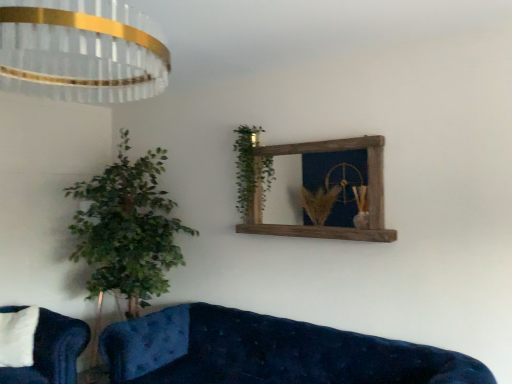
Describe the element at coordinates (326, 226) in the screenshot. I see `rustic wood mirror at upper center` at that location.

Identify the location of green leafy plant at upper center. (246, 166).

What are the coordinates of `crystal glass chandelier at upper left` in the screenshot? It's located at (81, 51).

How much space does velvet blue studio couch at lower left, the 1th studio couch positioned from the left, occupy horizontally?

9.05 inches.

I want to click on velvet blue couch at lower center, the second studio couch from the back, so click(x=269, y=352).

Between green leafy plant at left and velvet blue couch at lower center, the 2th studio couch viewed from the left, which one appears on the right side from the viewer's perspective?

velvet blue couch at lower center, the 2th studio couch viewed from the left.

From the image's perspective, is green leafy plant at left over velvet blue couch at lower center, marked as the 1th studio couch in a front-to-back arrangement?

Yes.

How much distance is there between green leafy plant at left and velvet blue couch at lower center, the second studio couch from the back?

31.45 inches.

Is green leafy plant at left aimed at velvet blue couch at lower center, marked as the first studio couch in a right-to-left arrangement?

No.

Based on the photo, would you say rustic wood mirror at upper center is a long distance from velvet blue couch at lower center, the second studio couch from the back?

rustic wood mirror at upper center is near velvet blue couch at lower center, the second studio couch from the back, not far away.

In the scene shown: Does rustic wood mirror at upper center have a lesser height compared to velvet blue couch at lower center, the second studio couch from the back?

Correct, rustic wood mirror at upper center is not as tall as velvet blue couch at lower center, the second studio couch from the back.

Which object is closer to the camera, rustic wood mirror at upper center or velvet blue couch at lower center, marked as the 1th studio couch in a front-to-back arrangement?

Positioned in front is velvet blue couch at lower center, marked as the 1th studio couch in a front-to-back arrangement.

Is point (377, 234) behind point (209, 344)?

That is False.

Considering the sizes of objects green leafy plant at left and rustic wood mirror at upper center in the image provided, who is wider, green leafy plant at left or rustic wood mirror at upper center?

With larger width is green leafy plant at left.

Is green leafy plant at left in contact with rustic wood mirror at upper center?

green leafy plant at left and rustic wood mirror at upper center are not in contact.

Which is in front, point (110, 166) or point (382, 214)?

The point (382, 214) is in front.

From the image's perspective, does green leafy plant at left appear higher than rustic wood mirror at upper center?

No, from the image's perspective, green leafy plant at left is not on top of rustic wood mirror at upper center.

Does velvet blue studio couch at lower left, which is the first studio couch from back to front, have a greater height compared to velvet blue couch at lower center, marked as the first studio couch in a right-to-left arrangement?

Incorrect, the height of velvet blue studio couch at lower left, which is the first studio couch from back to front, is not larger of that of velvet blue couch at lower center, marked as the first studio couch in a right-to-left arrangement.

Considering the relative sizes of velvet blue studio couch at lower left, the 1th studio couch positioned from the left, and velvet blue couch at lower center, marked as the 1th studio couch in a front-to-back arrangement, in the image provided, is velvet blue studio couch at lower left, the 1th studio couch positioned from the left, wider than velvet blue couch at lower center, marked as the 1th studio couch in a front-to-back arrangement,?

Incorrect, the width of velvet blue studio couch at lower left, the 1th studio couch positioned from the left, does not surpass that of velvet blue couch at lower center, marked as the 1th studio couch in a front-to-back arrangement.

Who is smaller, velvet blue studio couch at lower left, the 2th studio couch in the right-to-left sequence, or velvet blue couch at lower center, the second studio couch from the back?

Smaller between the two is velvet blue studio couch at lower left, the 2th studio couch in the right-to-left sequence.

Consider the image. From the image's perspective, is velvet blue studio couch at lower left, the 2th studio couch positioned from the front, located above velvet blue couch at lower center, the 2th studio couch viewed from the left?

Correct, velvet blue studio couch at lower left, the 2th studio couch positioned from the front, appears higher than velvet blue couch at lower center, the 2th studio couch viewed from the left, in the image.

Is crystal glass chandelier at upper left not inside rustic wood mirror at upper center?

crystal glass chandelier at upper left is positioned outside rustic wood mirror at upper center.

From a real-world perspective, is crystal glass chandelier at upper left over rustic wood mirror at upper center?

Yes.

Looking at this image, is crystal glass chandelier at upper left positioned far away from rustic wood mirror at upper center?

Yes, crystal glass chandelier at upper left and rustic wood mirror at upper center are quite far apart.

Between green leafy plant at upper center and crystal glass chandelier at upper left, which one appears on the right side from the viewer's perspective?

green leafy plant at upper center is more to the right.

In the image, is green leafy plant at upper center positioned in front of or behind crystal glass chandelier at upper left?

Visually, green leafy plant at upper center is located behind crystal glass chandelier at upper left.

Does green leafy plant at upper center have a lesser height compared to crystal glass chandelier at upper left?

In fact, green leafy plant at upper center may be taller than crystal glass chandelier at upper left.

Which object is thinner, green leafy plant at upper center or crystal glass chandelier at upper left?

Thinner between the two is green leafy plant at upper center.

Who is more distant, rustic wood mirror at upper center or crystal glass chandelier at upper left?

rustic wood mirror at upper center is behind.

What are the coordinates of `window frame lying below the crystal glass chandelier at upper left (from the image's perspective)` in the screenshot? It's located at (326, 226).

Is rustic wood mirror at upper center at the left side of crystal glass chandelier at upper left?

No.

Is rustic wood mirror at upper center directly adjacent to crystal glass chandelier at upper left?

No, rustic wood mirror at upper center is not with crystal glass chandelier at upper left.

At what (x,y) coordinates should I click in order to perform the action: click on the 2nd studio couch in front of the green leafy plant at left, counting from the anchor's position. Please return your answer as a coordinate pair (x, y). This screenshot has width=512, height=384. Looking at the image, I should click on (269, 352).

I want to click on studio couch that is the 1st one when counting leftward from the rustic wood mirror at upper center, so (269, 352).

From the image, which object appears to be nearer to crystal glass chandelier at upper left, velvet blue couch at lower center, the 2th studio couch viewed from the left, or rustic wood mirror at upper center?

rustic wood mirror at upper center lies closer to crystal glass chandelier at upper left than the other object.

From the image, which object appears to be nearer to velvet blue couch at lower center, marked as the 1th studio couch in a front-to-back arrangement, velvet blue studio couch at lower left, the 1th studio couch positioned from the left, or green leafy plant at upper center?

Based on the image, velvet blue studio couch at lower left, the 1th studio couch positioned from the left, appears to be nearer to velvet blue couch at lower center, marked as the 1th studio couch in a front-to-back arrangement.

Looking at the image, which one is located further to rustic wood mirror at upper center, velvet blue studio couch at lower left, the 2th studio couch positioned from the front, or velvet blue couch at lower center, marked as the 1th studio couch in a front-to-back arrangement?

Based on the image, velvet blue studio couch at lower left, the 2th studio couch positioned from the front, appears to be further to rustic wood mirror at upper center.

From the image, which object appears to be farther from rustic wood mirror at upper center, crystal glass chandelier at upper left or green leafy plant at left?

The object further to rustic wood mirror at upper center is crystal glass chandelier at upper left.

Estimate the real-world distances between objects in this image. Which object is further from crystal glass chandelier at upper left, rustic wood mirror at upper center or green leafy plant at left?

rustic wood mirror at upper center is positioned further to the anchor crystal glass chandelier at upper left.

Based on their spatial positions, is rustic wood mirror at upper center or green leafy plant at upper center closer to velvet blue couch at lower center, marked as the first studio couch in a right-to-left arrangement?

rustic wood mirror at upper center lies closer to velvet blue couch at lower center, marked as the first studio couch in a right-to-left arrangement, than the other object.

Considering their positions, is velvet blue studio couch at lower left, the 1th studio couch positioned from the left, positioned closer to green leafy plant at left than crystal glass chandelier at upper left?

velvet blue studio couch at lower left, the 1th studio couch positioned from the left, lies closer to green leafy plant at left than the other object.

Which object lies nearer to the anchor point rustic wood mirror at upper center, green leafy plant at upper center or velvet blue couch at lower center, the 2th studio couch viewed from the left?

The object closer to rustic wood mirror at upper center is green leafy plant at upper center.

The image size is (512, 384). Identify the location of houseplant between crystal glass chandelier at upper left and green leafy plant at upper center in the front-back direction. (127, 229).

You are a GUI agent. You are given a task and a screenshot of the screen. Output one action in this format:
    pyautogui.click(x=<x>, y=<y>)
    Task: Click on the window frame positioned between crystal glass chandelier at upper left and green leafy plant at left from near to far
    The width and height of the screenshot is (512, 384).
    Given the screenshot: What is the action you would take?
    pyautogui.click(x=326, y=226)

You are a GUI agent. You are given a task and a screenshot of the screen. Output one action in this format:
    pyautogui.click(x=<x>, y=<y>)
    Task: Click on the window frame between crystal glass chandelier at upper left and velvet blue couch at lower center, the 2th studio couch viewed from the left, vertically
    
    Given the screenshot: What is the action you would take?
    pyautogui.click(x=326, y=226)

You are a GUI agent. You are given a task and a screenshot of the screen. Output one action in this format:
    pyautogui.click(x=<x>, y=<y>)
    Task: Click on the vegetation located between velvet blue studio couch at lower left, the 2th studio couch in the right-to-left sequence, and rustic wood mirror at upper center in the left-right direction
    
    Given the screenshot: What is the action you would take?
    pos(246,166)